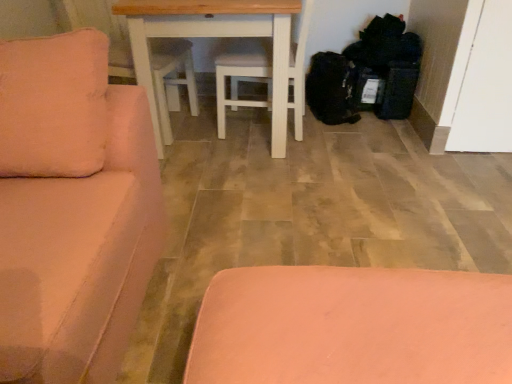
Question: Does pink matte ottoman at lower center appear on the left side of white painted wood table at center?

Choices:
 (A) yes
 (B) no

Answer: (B)

Question: From a real-world perspective, is pink matte ottoman at lower center positioned over white painted wood table at center based on gravity?

Choices:
 (A) yes
 (B) no

Answer: (B)

Question: Is pink matte ottoman at lower center directly adjacent to white painted wood table at center?

Choices:
 (A) no
 (B) yes

Answer: (A)

Question: Does pink matte ottoman at lower center come behind white painted wood table at center?

Choices:
 (A) no
 (B) yes

Answer: (A)

Question: Does pink matte ottoman at lower center have a larger size compared to white painted wood table at center?

Choices:
 (A) yes
 (B) no

Answer: (B)

Question: Can you confirm if pink matte ottoman at lower center is thinner than white painted wood table at center?

Choices:
 (A) no
 (B) yes

Answer: (A)

Question: Is black fabric bags at lower right positioned behind white painted wood table at center?

Choices:
 (A) no
 (B) yes

Answer: (B)

Question: Can you see black fabric bags at lower right touching white painted wood table at center?

Choices:
 (A) no
 (B) yes

Answer: (A)

Question: From the image's perspective, is black fabric bags at lower right on white painted wood table at center?

Choices:
 (A) yes
 (B) no

Answer: (A)

Question: Is black fabric bags at lower right facing towards white painted wood table at center?

Choices:
 (A) no
 (B) yes

Answer: (A)

Question: Does black fabric bags at lower right appear on the right side of white painted wood table at center?

Choices:
 (A) yes
 (B) no

Answer: (A)

Question: Considering the relative sizes of black fabric bags at lower right and white painted wood table at center in the image provided, is black fabric bags at lower right taller than white painted wood table at center?

Choices:
 (A) no
 (B) yes

Answer: (A)

Question: Is velvet pink couch at left in front of pink matte ottoman at lower center?

Choices:
 (A) no
 (B) yes

Answer: (B)